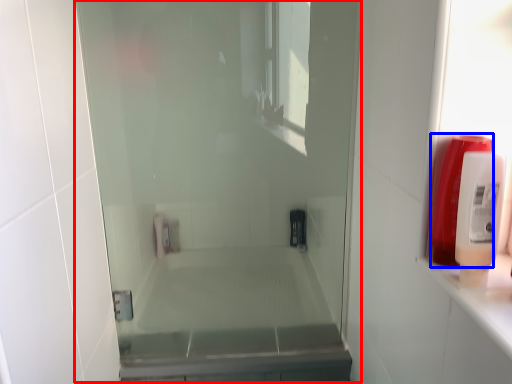
Question: Among these objects, which one is farthest to the camera, screen door (highlighted by a red box) or soap dispenser (highlighted by a blue box)?

Choices:
 (A) screen door
 (B) soap dispenser

Answer: (A)